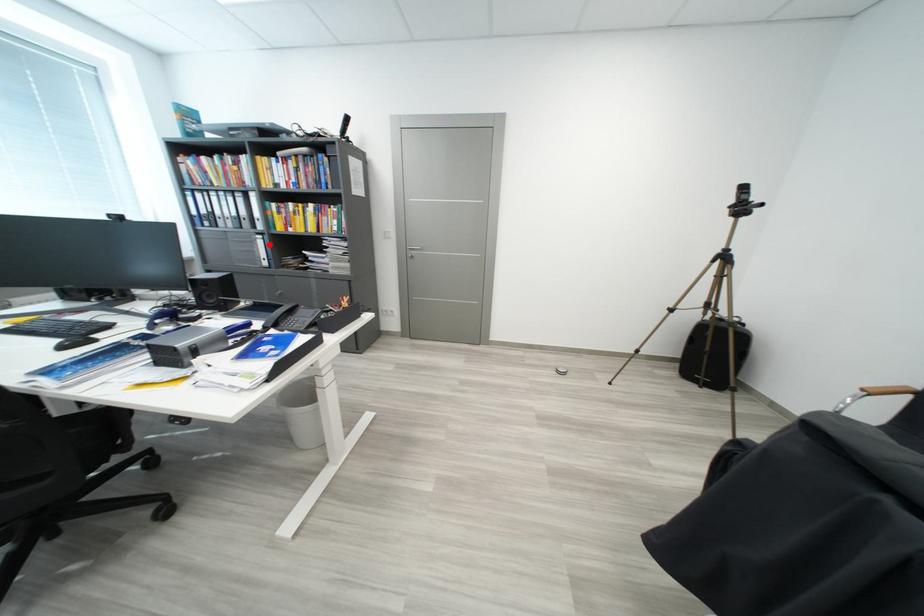
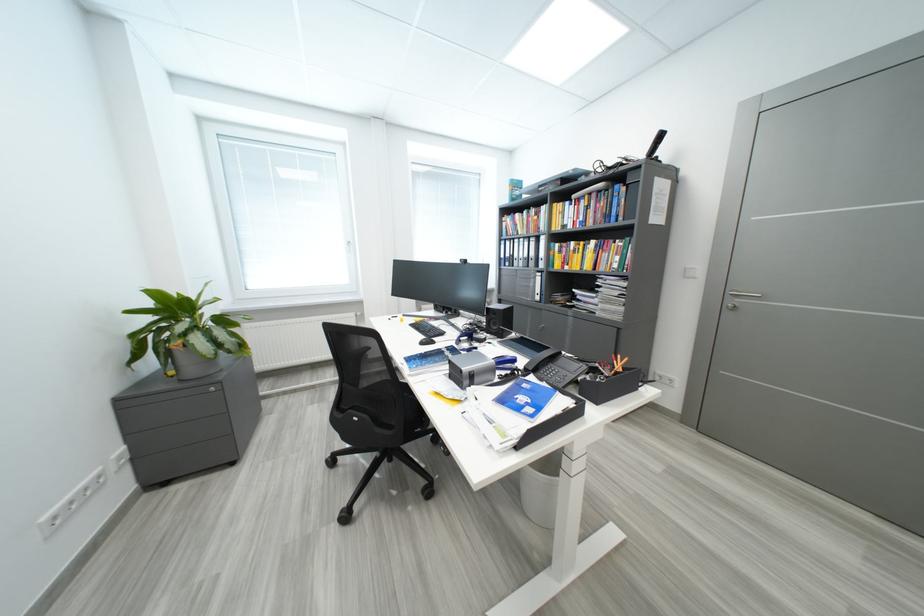
The point at the highlighted location is marked in the first image. Where is the corresponding point in the second image?

(546, 282)